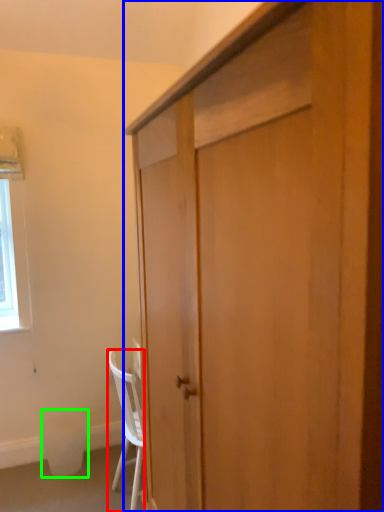
Question: Based on their relative distances, which object is farther from chair (highlighted by a red box)? Choose from cabinetry (highlighted by a blue box) and trash bin/can (highlighted by a green box).

Choices:
 (A) cabinetry
 (B) trash bin/can

Answer: (A)